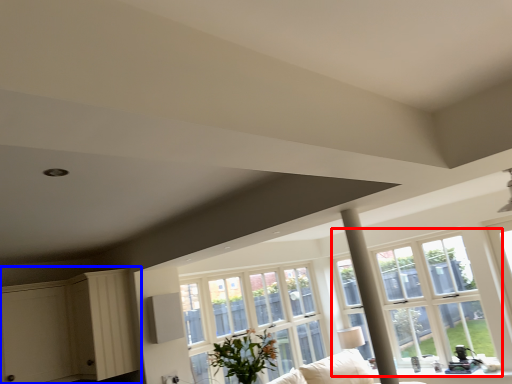
Question: Which object is further to the camera taking this photo, window (highlighted by a red box) or dresser (highlighted by a blue box)?

Choices:
 (A) window
 (B) dresser

Answer: (A)